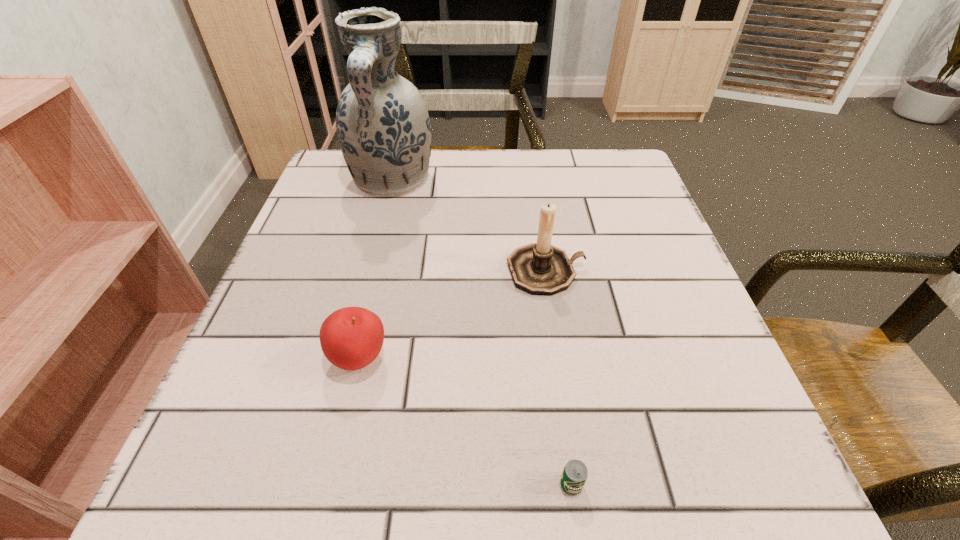
The image size is (960, 540). Find the location of `vase`. vase is located at coordinates (384, 131).

Where is `the farthest object`? Image resolution: width=960 pixels, height=540 pixels. the farthest object is located at coordinates (384, 131).

The image size is (960, 540). What are the coordinates of `candle holder` in the screenshot? It's located at (540, 268).

Locate an element on the screen. Image resolution: width=960 pixels, height=540 pixels. the third shortest object is located at coordinates (540, 268).

At what (x,y) coordinates should I click in order to perform the action: click on apple. Please return your answer as a coordinate pair (x, y). The width and height of the screenshot is (960, 540). Looking at the image, I should click on (351, 338).

Where is `the third farthest object`? The image size is (960, 540). the third farthest object is located at coordinates (351, 338).

Find the location of a particular element. The height and width of the screenshot is (540, 960). the nearest object is located at coordinates (574, 476).

Identify the location of beer can. The image size is (960, 540). (574, 476).

Locate an element on the screen. vacant space located with the handle on the side of the tallest object is located at coordinates (360, 307).

The height and width of the screenshot is (540, 960). What are the coordinates of `vacant region located 0.170m on the left of the candle holder` in the screenshot? It's located at (416, 271).